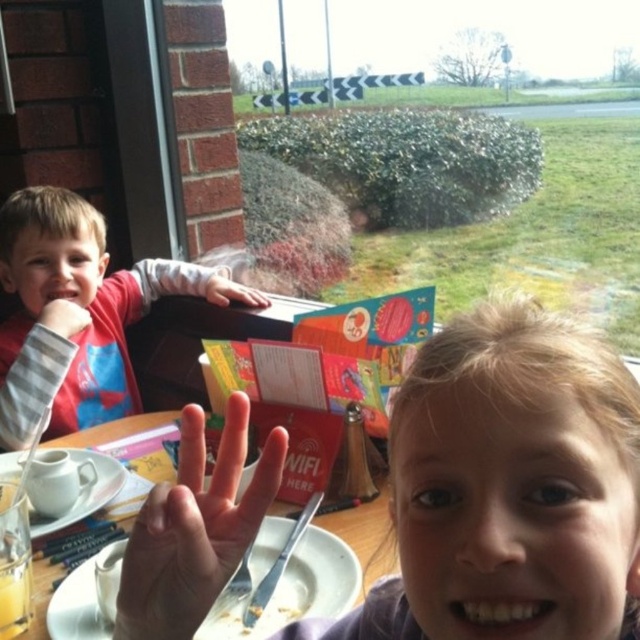
In the scene shown: You are a photographer trying to capture a closeup of the white matte plate at lower center without the smooth skin hand at upper left blocking it. Given their sizes, which object should you focus on to ensure the plate is fully visible?

The white matte plate at lower center is wider than the smooth skin hand at upper left, so focusing on the plate will ensure it is fully visible without obstruction.